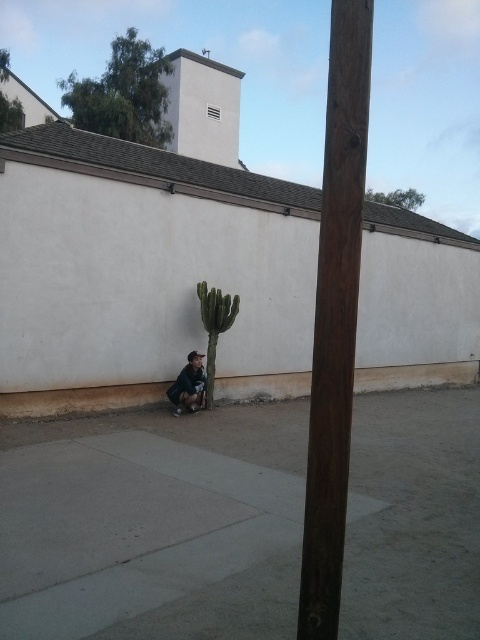
Where is `gray concrete pavement at lower center`? gray concrete pavement at lower center is located at coordinates (153, 524).

Can you confirm if gray concrete pavement at lower center is positioned to the right of brown wooden pole at center?

In fact, gray concrete pavement at lower center is to the left of brown wooden pole at center.

Between point (425, 612) and point (351, 54), which one is positioned in front?

Positioned in front is point (351, 54).

Where is `gray concrete pavement at lower center`? gray concrete pavement at lower center is located at coordinates pyautogui.click(x=153, y=524).

Is point (142, 493) closer to camera compared to point (46, 397)?

Yes, point (142, 493) is closer to viewer.

Can you confirm if gray concrete pavement at lower center is bigger than brown concrete curb at lower left?

No.

At what (x,y) coordinates should I click in order to perform the action: click on gray concrete pavement at lower center. Please return your answer as a coordinate pair (x, y). Looking at the image, I should click on pos(153,524).

Does gray concrete pavement at lower center appear on the right side of dark blue jeans at lower center?

Indeed, gray concrete pavement at lower center is positioned on the right side of dark blue jeans at lower center.

Is point (391, 579) farther from camera compared to point (186, 369)?

That is False.

Where is `gray concrete pavement at lower center`? The width and height of the screenshot is (480, 640). gray concrete pavement at lower center is located at coordinates (153, 524).